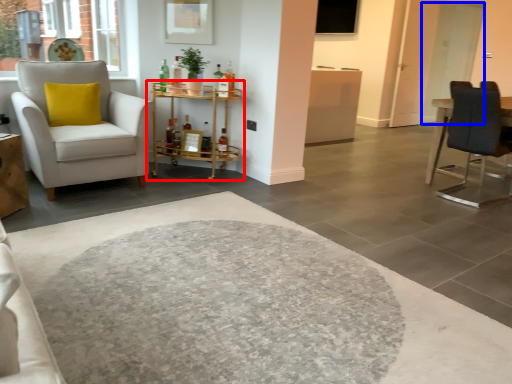
Question: Which point is further to the camera, table (highlighted by a red box) or glass door (highlighted by a blue box)?

Choices:
 (A) table
 (B) glass door

Answer: (B)